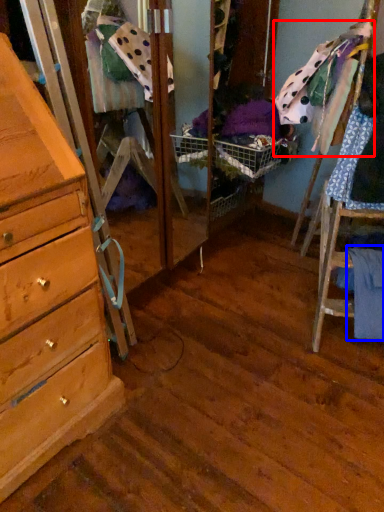
Question: Which of the following is the closest to the observer, clothing (highlighted by a red box) or clothing (highlighted by a blue box)?

Choices:
 (A) clothing
 (B) clothing

Answer: (A)